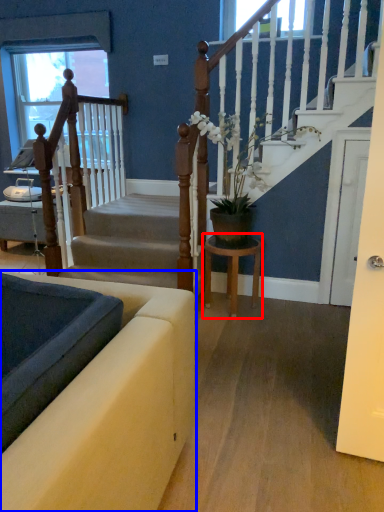
Question: Which point is further to the camera, table (highlighted by a red box) or studio couch (highlighted by a blue box)?

Choices:
 (A) table
 (B) studio couch

Answer: (A)